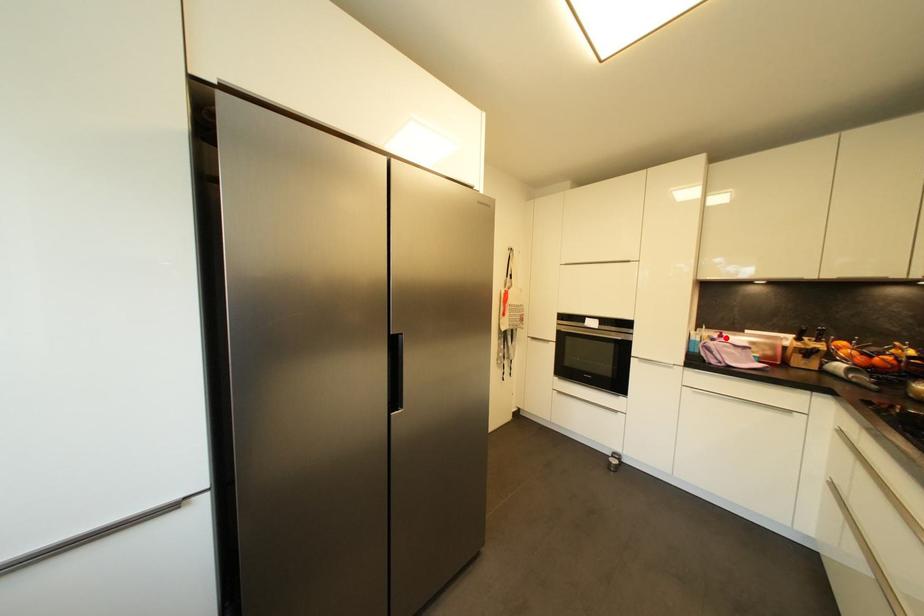
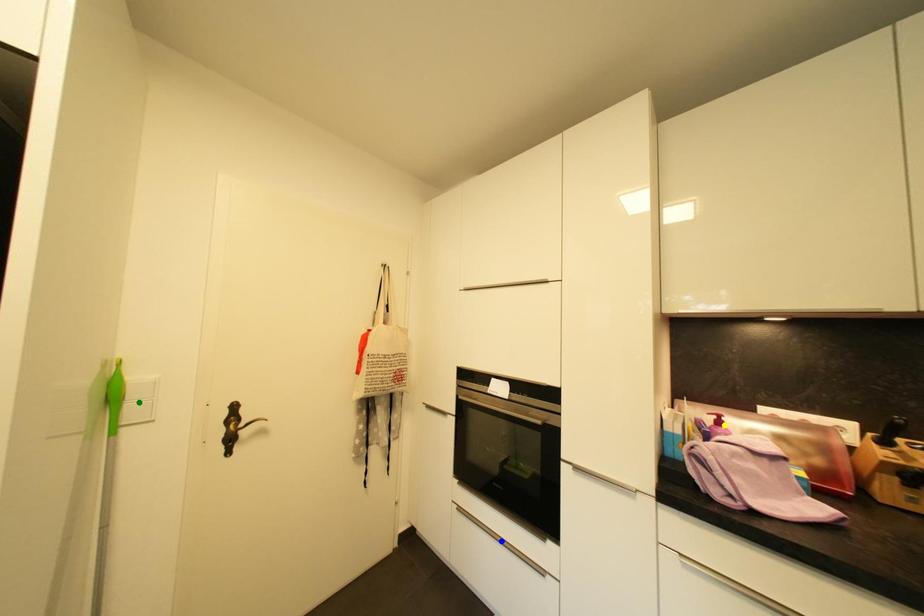
Question: I am providing you with two images of the same scene from different viewpoints. A red point is marked on the first image. You are given multiple points on the second image. Which point in image 2 represents the same 3d spot as the red point in image 1?

Choices:
 (A) yellow point
 (B) green point
 (C) blue point

Answer: (A)